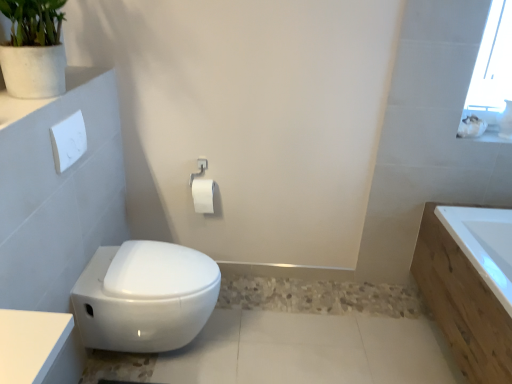
Question: Considering the relative positions of white matte toilet paper at center and white glossy bidet at lower left in the image provided, is white matte toilet paper at center to the left of white glossy bidet at lower left from the viewer's perspective?

Choices:
 (A) yes
 (B) no

Answer: (B)

Question: From a real-world perspective, is white matte toilet paper at center physically below white glossy bidet at lower left?

Choices:
 (A) no
 (B) yes

Answer: (A)

Question: Does white matte toilet paper at center have a greater width compared to white glossy bidet at lower left?

Choices:
 (A) yes
 (B) no

Answer: (B)

Question: Does white matte toilet paper at center come behind white glossy bidet at lower left?

Choices:
 (A) yes
 (B) no

Answer: (A)

Question: Is white matte toilet paper at center positioned far away from white glossy bidet at lower left?

Choices:
 (A) no
 (B) yes

Answer: (A)

Question: Considering the relative sizes of white matte toilet paper at center and white glossy bidet at lower left in the image provided, is white matte toilet paper at center bigger than white glossy bidet at lower left?

Choices:
 (A) yes
 (B) no

Answer: (B)

Question: From the image's perspective, is white wood bathtub at right above white matte toilet paper at center?

Choices:
 (A) yes
 (B) no

Answer: (B)

Question: Considering the relative sizes of white wood bathtub at right and white matte toilet paper at center in the image provided, is white wood bathtub at right wider than white matte toilet paper at center?

Choices:
 (A) yes
 (B) no

Answer: (A)

Question: Considering the relative sizes of white wood bathtub at right and white matte toilet paper at center in the image provided, is white wood bathtub at right taller than white matte toilet paper at center?

Choices:
 (A) no
 (B) yes

Answer: (B)

Question: Is white wood bathtub at right at the left side of white matte toilet paper at center?

Choices:
 (A) no
 (B) yes

Answer: (A)

Question: Does white wood bathtub at right have a smaller size compared to white matte toilet paper at center?

Choices:
 (A) yes
 (B) no

Answer: (B)

Question: Is white wood bathtub at right in front of white matte toilet paper at center?

Choices:
 (A) no
 (B) yes

Answer: (B)

Question: Is white matte toilet paper at center completely or partially inside white glossy ledge at upper left?

Choices:
 (A) no
 (B) yes

Answer: (A)